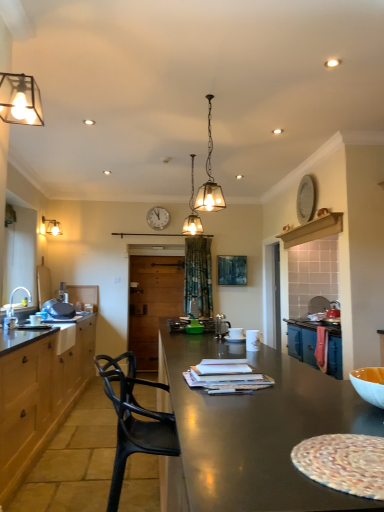
Question: Which direction should I rotate to look at matte glass pendant light at center, the 3th lamp positioned from the back, — up or down?

Choices:
 (A) down
 (B) up

Answer: (B)

Question: Is white wooden clock at upper center completely or partially inside matte brown countertop at left?

Choices:
 (A) no
 (B) yes

Answer: (A)

Question: Is the depth of matte brown countertop at left greater than that of white wooden clock at upper center?

Choices:
 (A) no
 (B) yes

Answer: (A)

Question: From a real-world perspective, does matte brown countertop at left stand above white wooden clock at upper center?

Choices:
 (A) yes
 (B) no

Answer: (B)

Question: From a real-world perspective, is matte brown countertop at left physically below white wooden clock at upper center?

Choices:
 (A) no
 (B) yes

Answer: (B)

Question: Is matte brown countertop at left wider than white wooden clock at upper center?

Choices:
 (A) no
 (B) yes

Answer: (B)

Question: Is matte brown countertop at left far from white wooden clock at upper center?

Choices:
 (A) no
 (B) yes

Answer: (B)

Question: From the image's perspective, is white glossy sink at left located above translucent glass pendant light at center, which ranks as the third lamp in front-to-back order?

Choices:
 (A) yes
 (B) no

Answer: (B)

Question: Is white glossy sink at left closer to the viewer compared to translucent glass pendant light at center, which ranks as the 2th lamp in right-to-left order?

Choices:
 (A) no
 (B) yes

Answer: (B)

Question: Can translucent glass pendant light at center, which ranks as the third lamp in front-to-back order, be found inside white glossy sink at left?

Choices:
 (A) yes
 (B) no

Answer: (B)

Question: Can we say white glossy sink at left lies outside translucent glass pendant light at center, which ranks as the third lamp in front-to-back order?

Choices:
 (A) no
 (B) yes

Answer: (B)

Question: Does white glossy sink at left have a greater height compared to translucent glass pendant light at center, acting as the second lamp starting from the back?

Choices:
 (A) yes
 (B) no

Answer: (B)

Question: Does white glossy sink at left turn towards translucent glass pendant light at center, acting as the second lamp starting from the back?

Choices:
 (A) no
 (B) yes

Answer: (A)

Question: Does satin silver coffee pot at center have a smaller size compared to white wooden clock at upper center?

Choices:
 (A) yes
 (B) no

Answer: (A)